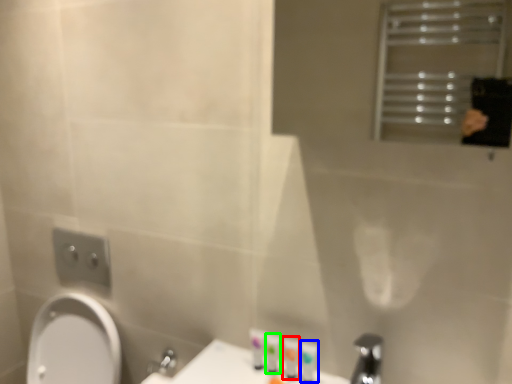
Question: Based on their relative distances, which object is nearer to toiletry (highlighted by a red box)? Choose from toiletry (highlighted by a blue box) and toiletry (highlighted by a green box).

Choices:
 (A) toiletry
 (B) toiletry

Answer: (A)